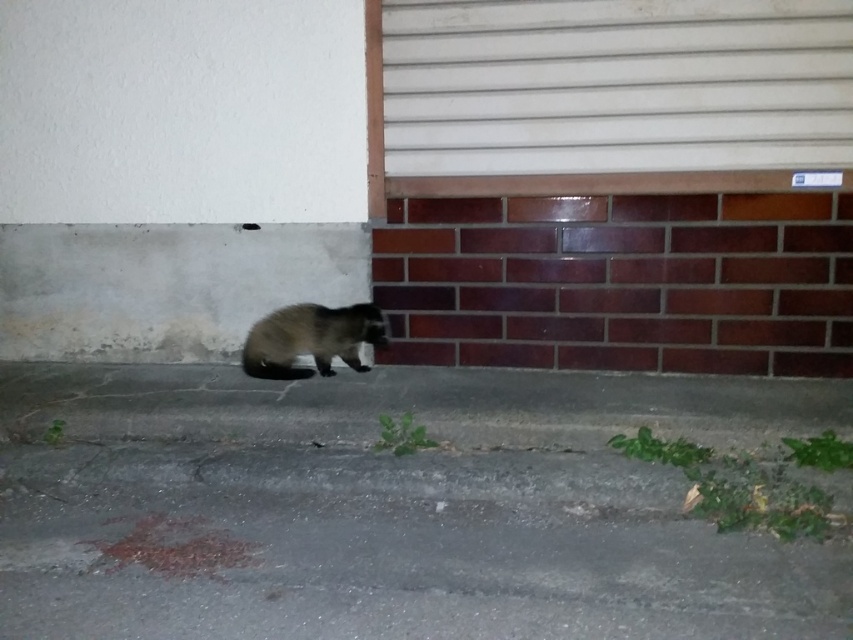
You are a delivery robot navigating an urban area. You need to deliver a package to a location marked by the point at coordinates (x=387, y=548). The raccoon is on the paved surface near the building. Can you safely reach the marked point without getting too close to the raccoon?

The point at coordinates (x=387, y=548) marks gray asphalt pavement at lower center, so yes, the delivery robot can safely reach the marked point as it is located on the asphalt pavement, which is a suitable path, and the raccoon is on the paved surface near the building, so the robot can navigate around it to avoid getting too close.

Based on the photo, you are a delivery robot trying to navigate through the urban scene. You need to move from your current position to the building entrance. There is a gray asphalt pavement at lower center and a fuzzy brown fur at lower center in your path. Which object should you avoid to ensure you have enough space to pass?

The gray asphalt pavement at lower center is bigger than fuzzy brown fur at lower center, so you should avoid the fuzzy brown fur at lower center since it takes up less space and can be easily maneuvered around.

You are a photographer trying to capture a clear shot of the fuzzy brown fur at lower center without the gray concrete curb at lower center blocking the view. Can you adjust your position to achieve this?

The gray concrete curb at lower center is in front of the fuzzy brown fur at lower center, so moving your camera position behind the curb would allow you to capture the fuzzy brown fur at lower center without obstruction.